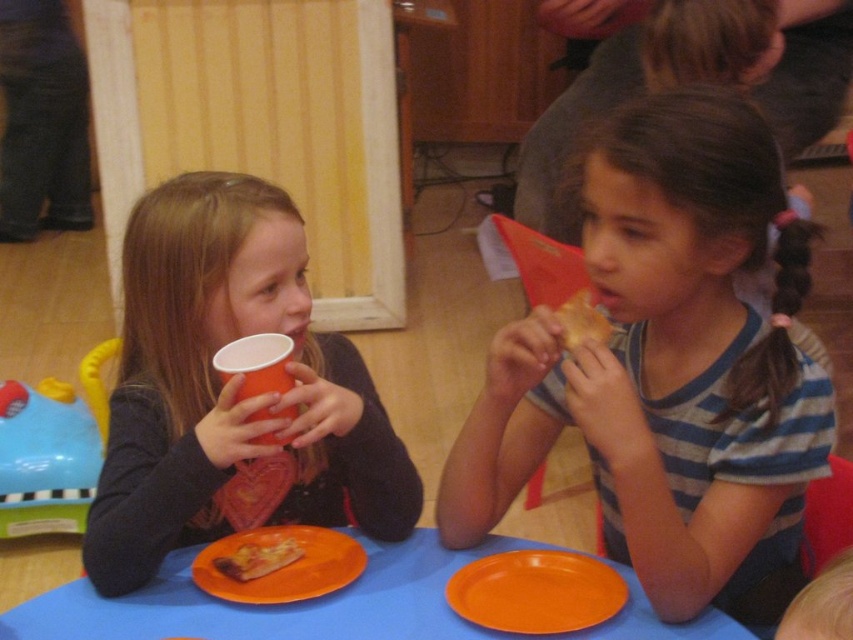
Between orange plastic plate at lower center and golden crispy pizza at upper right, which one has less height?

orange plastic plate at lower center

Is orange plastic plate at lower center wider than golden crispy pizza at upper right?

Correct, the width of orange plastic plate at lower center exceeds that of golden crispy pizza at upper right.

Where is `orange plastic plate at lower center`? This screenshot has height=640, width=853. orange plastic plate at lower center is located at coordinates (285, 566).

Which is above, matte plastic cup at left or golden crispy pizza at upper right?

golden crispy pizza at upper right

Is matte plastic cup at left positioned at the back of golden crispy pizza at upper right?

No, it is in front of golden crispy pizza at upper right.

What do you see at coordinates (230, 390) in the screenshot? I see `matte plastic cup at left` at bounding box center [230, 390].

Where is `matte plastic cup at left`? matte plastic cup at left is located at coordinates [x=230, y=390].

Image resolution: width=853 pixels, height=640 pixels. Describe the element at coordinates (537, 592) in the screenshot. I see `orange matte plate at lower center` at that location.

Does orange matte plate at lower center have a larger size compared to golden crispy pizza at upper right?

No, orange matte plate at lower center is not bigger than golden crispy pizza at upper right.

This screenshot has height=640, width=853. In order to click on orange matte plate at lower center in this screenshot , I will do `click(537, 592)`.